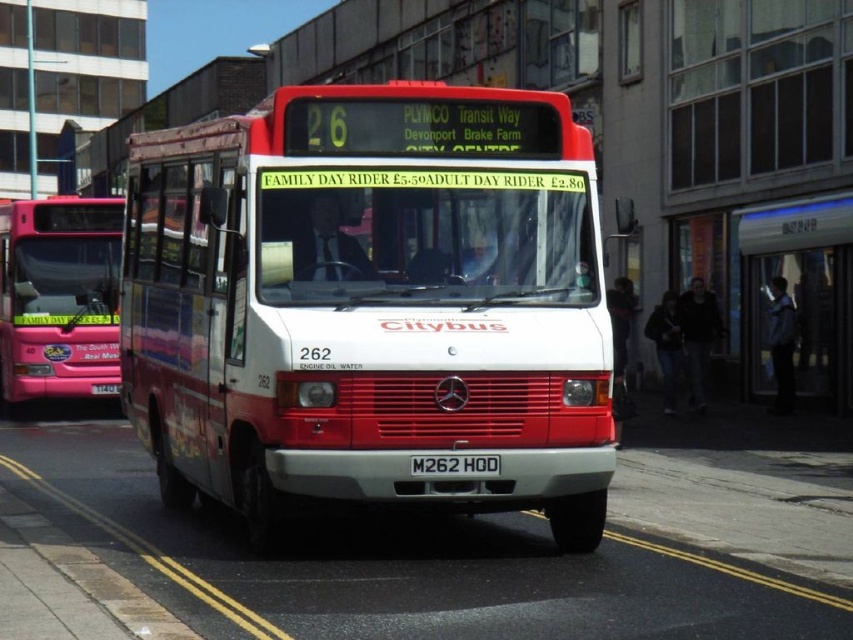
Is white matte bus at center positioned at the back of black plastic license plate at center?

Yes, it is behind black plastic license plate at center.

Is white matte bus at center taller than black plastic license plate at center?

Correct, white matte bus at center is much taller as black plastic license plate at center.

Locate an element on the screen. This screenshot has height=640, width=853. white matte bus at center is located at coordinates (370, 305).

Identify the location of transparent glass bus stop at center. (799, 294).

Is transparent glass bus stop at center taller than black plastic license plate at center?

Indeed, transparent glass bus stop at center has a greater height compared to black plastic license plate at center.

This screenshot has height=640, width=853. In order to click on transparent glass bus stop at center in this screenshot , I will do `click(799, 294)`.

Locate an element on the screen. This screenshot has height=640, width=853. transparent glass bus stop at center is located at coordinates pos(799,294).

Who is shorter, white matte bus at center or transparent glass bus stop at center?

With less height is white matte bus at center.

Does white matte bus at center appear on the left side of transparent glass bus stop at center?

Result: Yes, white matte bus at center is to the left of transparent glass bus stop at center.

Does point (372, 131) lie behind point (799, 316)?

No, it is not.

This screenshot has height=640, width=853. I want to click on white matte bus at center, so click(370, 305).